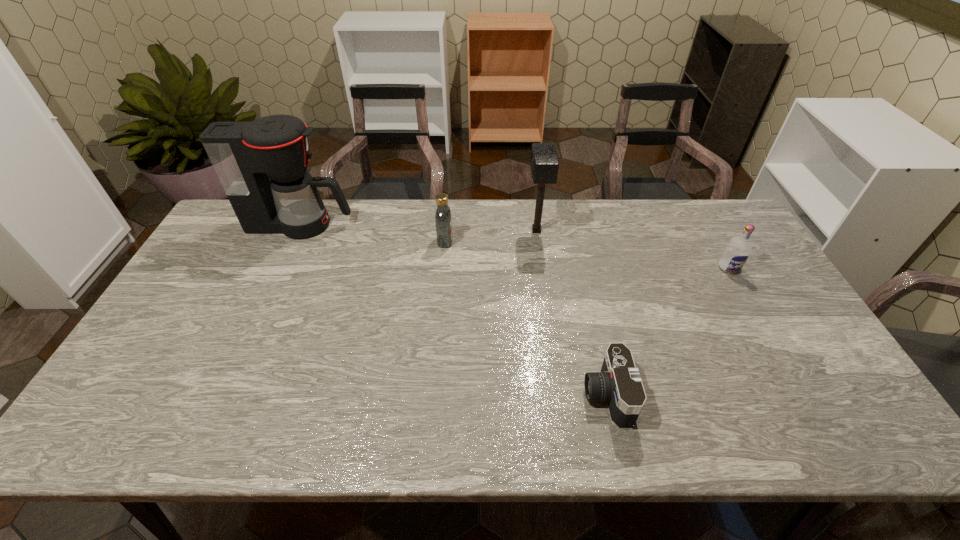
Select which object appears as the closest to the farther vodka. Please provide its 2D coordinates. Your answer should be formatted as a tuple, i.e. [(x, y)], where the tuple contains the x and y coordinates of a point satisfying the conditions above.

[(544, 163)]

In order to click on object that is the second closest to the leftmost object in this screenshot , I will do `click(544, 163)`.

Image resolution: width=960 pixels, height=540 pixels. Identify the location of free space that satisfies the following two spatial constraints: 1. on the back side of the third object from left to right; 2. pour from the carafe of the tallest object. (536, 225).

I want to click on vacant space that satisfies the following two spatial constraints: 1. on the back side of the second tallest object; 2. pour from the carafe of the coffee maker, so click(x=536, y=225).

This screenshot has height=540, width=960. I want to click on vacant space that satisfies the following two spatial constraints: 1. on the label of the right vodka; 2. on the front-facing side of the second object from right to left, so click(803, 395).

Identify the location of vacant space that satisfies the following two spatial constraints: 1. on the label of the nearer vodka; 2. on the front-facing side of the nearest object. This screenshot has width=960, height=540. (803, 395).